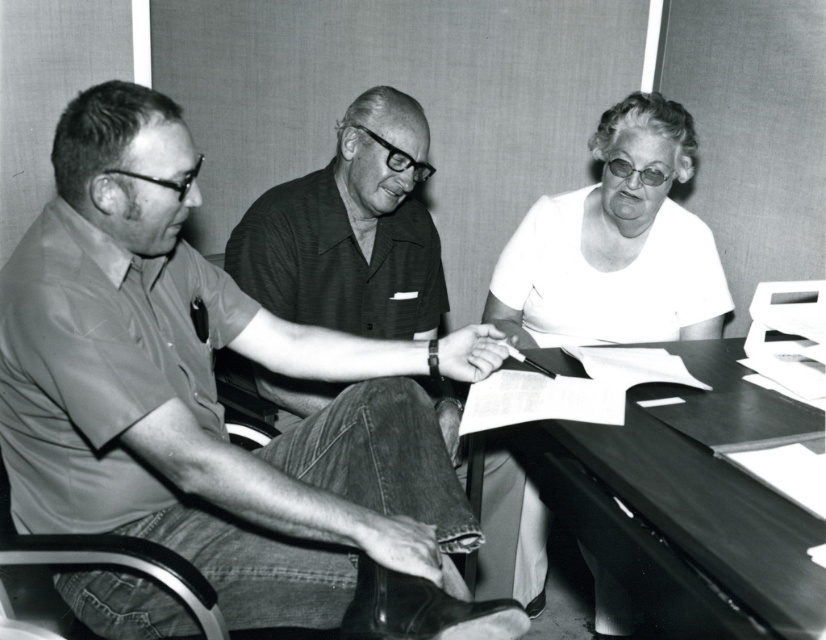
You are standing in front of the table and want to hand a document to the person at the center. Which direction should you move to reach the matte gray shirt at center?

Since the matte gray shirt at center is located at coordinates 0.614 on the x axis and 0.253 on the y axis, you should move towards the center of the table to reach them.

You are observing a black and white photograph of three people around a table. You need to determine the position of the matte gray shirt at center relative to the other individuals. Which individual is seated at the center of the table?

The matte gray shirt at center is located at point (x=207, y=392), which places it at the center of the table.

You are taking a photo of two points in the scene. Which point is closer to the camera, point at coordinates point (31, 451) or point (573, 424)?

Point at coordinates point (31, 451) is closer to the camera than point (573, 424).